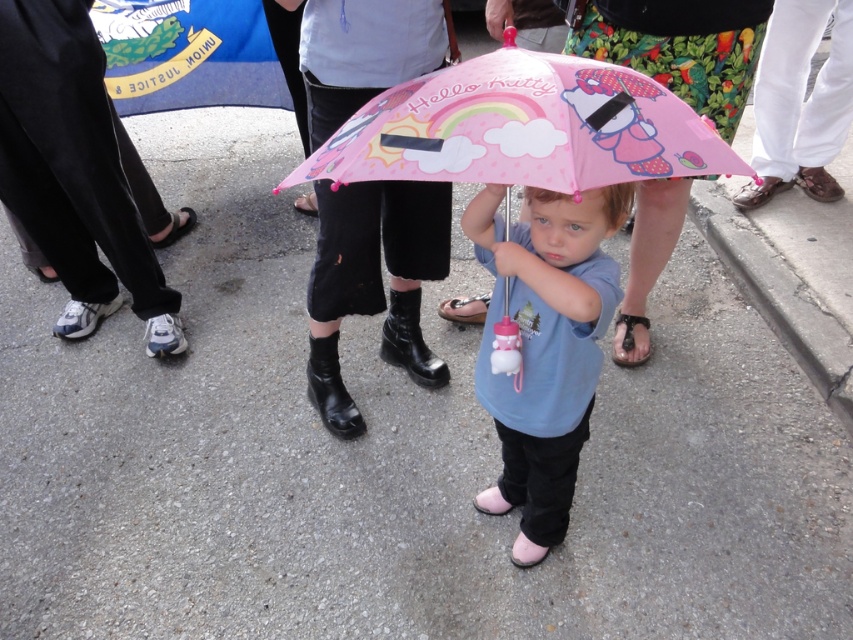
Question: Does pink matte umbrella at center lie behind pink leather sandal at center?

Choices:
 (A) no
 (B) yes

Answer: (A)

Question: Among these objects, which one is nearest to the camera?

Choices:
 (A) pink leather sandal at center
 (B) black leather sandal at lower center
 (C) matte pink umbrella at center
 (D) pink matte umbrella at center

Answer: (D)

Question: Which point is farther from the camera taking this photo?

Choices:
 (A) (598, 333)
 (B) (624, 358)
 (C) (550, 124)
 (D) (445, 317)

Answer: (D)

Question: Can you confirm if pink matte umbrella at center is positioned above black leather sandal at lower center?

Choices:
 (A) yes
 (B) no

Answer: (A)

Question: Based on their relative distances, which object is farther from the black leather sandal at lower center?

Choices:
 (A) pink matte umbrella at center
 (B) matte pink umbrella at center

Answer: (A)

Question: Considering the relative positions of pink matte umbrella at center and pink leather sandal at center in the image provided, where is pink matte umbrella at center located with respect to pink leather sandal at center?

Choices:
 (A) left
 (B) right

Answer: (A)